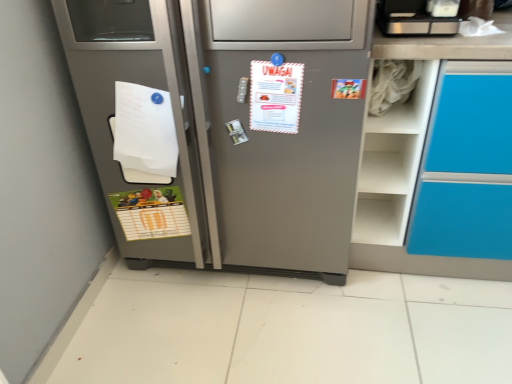
Locate an element on the screen. green matte postcard at lower left, which appears as the second postcard when viewed from the front is located at coordinates (151, 213).

What do you see at coordinates (275, 96) in the screenshot? The height and width of the screenshot is (384, 512). I see `white paper at center, which is the 2th postcard in back-to-front order` at bounding box center [275, 96].

You are a GUI agent. You are given a task and a screenshot of the screen. Output one action in this format:
    pyautogui.click(x=<x>, y=<y>)
    Task: Click on the white matte shelf at upper right
    The width and height of the screenshot is (512, 384).
    Given the screenshot: What is the action you would take?
    pyautogui.click(x=407, y=108)

Considering the relative positions of satin silver refrigerator at center and white paper at center, placed as the first postcard when sorted from front to back, in the image provided, is satin silver refrigerator at center to the right of white paper at center, placed as the first postcard when sorted from front to back, from the viewer's perspective?

No.

Is satin silver refrigerator at center inside or outside of white paper at center, which is the 2th postcard in back-to-front order?

satin silver refrigerator at center is outside white paper at center, which is the 2th postcard in back-to-front order.

From the image's perspective, would you say satin silver refrigerator at center is positioned over white paper at center, the second postcard when ordered from bottom to top?

Incorrect, from the image's perspective, satin silver refrigerator at center is lower than white paper at center, the second postcard when ordered from bottom to top.

Are satin silver refrigerator at center and white paper at center, which is the first postcard from right to left, making contact?

→ No, satin silver refrigerator at center is not in contact with white paper at center, which is the first postcard from right to left.

Considering the relative sizes of white paper at left and white matte shelf at upper right in the image provided, is white paper at left thinner than white matte shelf at upper right?

Yes, white paper at left is thinner than white matte shelf at upper right.

Considering the relative sizes of white paper at left and white matte shelf at upper right in the image provided, is white paper at left bigger than white matte shelf at upper right?

Correct, white paper at left is larger in size than white matte shelf at upper right.

Between white paper at left and white matte shelf at upper right, which one has more height?

With more height is white paper at left.

Is white paper at left in front of or behind white matte shelf at upper right in the image?

Visually, white paper at left is located in front of white matte shelf at upper right.

Can you tell me how much white paper at left and satin silver refrigerator at center differ in facing direction?

The angular difference between white paper at left and satin silver refrigerator at center is 1.23 degrees.

Which object is wider, white paper at left or satin silver refrigerator at center?

With larger width is satin silver refrigerator at center.

Between point (154, 120) and point (265, 267), which one is positioned in front?

The point (154, 120) is in front.

Can you confirm if green matte postcard at lower left, placed as the 1th postcard when sorted from left to right, is smaller than satin silver refrigerator at center?

Yes.

From a real-world perspective, which object stands above the other?

satin silver refrigerator at center.

Between green matte postcard at lower left, which ranks as the first postcard in bottom-to-top order, and satin silver refrigerator at center, which one has more height?

Standing taller between the two is satin silver refrigerator at center.

Is white paper at center, which is the 2th postcard in back-to-front order, completely or partially outside of white matte shelf at upper right?

Yes, white paper at center, which is the 2th postcard in back-to-front order, is located beyond the bounds of white matte shelf at upper right.

Between white paper at center, which is the first postcard from right to left, and white matte shelf at upper right, which one is positioned in front?

white paper at center, which is the first postcard from right to left.

Based on the photo, which of these two, white paper at center, placed as the first postcard when sorted from front to back, or white matte shelf at upper right, stands shorter?

With less height is white matte shelf at upper right.

How different are the orientations of white paper at center, the second postcard when ordered from bottom to top, and white matte shelf at upper right in degrees?

There is a 7.03-degree angle between the facing directions of white paper at center, the second postcard when ordered from bottom to top, and white matte shelf at upper right.

Is white matte shelf at upper right bigger or smaller than white paper at left?

Considering their sizes, white matte shelf at upper right takes up less space than white paper at left.

Which object is closer to the camera taking this photo, white matte shelf at upper right or white paper at left?

Positioned in front is white paper at left.

In the scene shown: From a real-world perspective, is white matte shelf at upper right on white paper at left?

Correct, in the physical world, white matte shelf at upper right is higher than white paper at left.

Is satin silver refrigerator at center bigger or smaller than white matte shelf at upper right?

In the image, satin silver refrigerator at center appears to be larger than white matte shelf at upper right.

Would you say satin silver refrigerator at center is inside or outside white matte shelf at upper right?

satin silver refrigerator at center exists outside the volume of white matte shelf at upper right.

Is satin silver refrigerator at center facing away from white matte shelf at upper right?

That's not correct — satin silver refrigerator at center is not looking away from white matte shelf at upper right.

Is satin silver refrigerator at center closer to camera compared to white matte shelf at upper right?

Yes, satin silver refrigerator at center is closer to the camera.

Identify the location of refrigerator that appears below the white paper at center, placed as the first postcard when sorted from front to back (from a real-world perspective). (279, 133).

Find the location of a particular element. Image resolution: width=512 pixels, height=384 pixels. shelf on the right of white paper at left is located at coordinates (407, 108).

Looking at the image, which one is located further to white matte shelf at upper right, white paper at left or brushed metal toaster at upper right?

Based on the image, white paper at left appears to be further to white matte shelf at upper right.

Estimate the real-world distances between objects in this image. Which object is further from brushed metal toaster at upper right, satin silver refrigerator at center or white paper at center, which is the 2th postcard in back-to-front order?

satin silver refrigerator at center lies further to brushed metal toaster at upper right than the other object.

Considering their positions, is white paper at center, which is the first postcard in top-to-bottom order, positioned further to green matte postcard at lower left, which appears as the second postcard when viewed from the front, than satin silver refrigerator at center?

white paper at center, which is the first postcard in top-to-bottom order, is positioned further to the anchor green matte postcard at lower left, which appears as the second postcard when viewed from the front.

Which object lies further to the anchor point satin silver refrigerator at center, brushed metal toaster at upper right or white matte shelf at upper right?

Among the two, brushed metal toaster at upper right is located further to satin silver refrigerator at center.

Looking at the image, which one is located closer to white matte shelf at upper right, satin silver refrigerator at center or brushed metal toaster at upper right?

Based on the image, brushed metal toaster at upper right appears to be nearer to white matte shelf at upper right.

Looking at the image, which one is located closer to green matte postcard at lower left, which is the 2th postcard from right to left, white matte shelf at upper right or satin silver refrigerator at center?

Among the two, satin silver refrigerator at center is located nearer to green matte postcard at lower left, which is the 2th postcard from right to left.

Which object lies nearer to the anchor point white matte shelf at upper right, green matte postcard at lower left, which is the 2th postcard from right to left, or satin silver refrigerator at center?

Among the two, satin silver refrigerator at center is located nearer to white matte shelf at upper right.

In the scene shown: Looking at the image, which one is located further to brushed metal toaster at upper right, green matte postcard at lower left, arranged as the 2th postcard when viewed from the top, or white paper at center, the 2th postcard positioned from the left?

Based on the image, green matte postcard at lower left, arranged as the 2th postcard when viewed from the top, appears to be further to brushed metal toaster at upper right.

This screenshot has width=512, height=384. I want to click on postcard between green matte postcard at lower left, arranged as the first postcard when viewed from the back, and brushed metal toaster at upper right, in the horizontal direction, so click(x=275, y=96).

The width and height of the screenshot is (512, 384). Find the location of `shelf between white paper at left and brushed metal toaster at upper right in the horizontal direction`. shelf between white paper at left and brushed metal toaster at upper right in the horizontal direction is located at coordinates (407, 108).

What are the coordinates of `refrigerator located between green matte postcard at lower left, arranged as the 2th postcard when viewed from the top, and white matte shelf at upper right in the left-right direction` in the screenshot? It's located at (279, 133).

You are a GUI agent. You are given a task and a screenshot of the screen. Output one action in this format:
    pyautogui.click(x=<x>, y=<y>)
    Task: Click on the shelf between white paper at center, the 2th postcard positioned from the left, and brushed metal toaster at upper right from left to right
    The height and width of the screenshot is (384, 512).
    Given the screenshot: What is the action you would take?
    pyautogui.click(x=407, y=108)